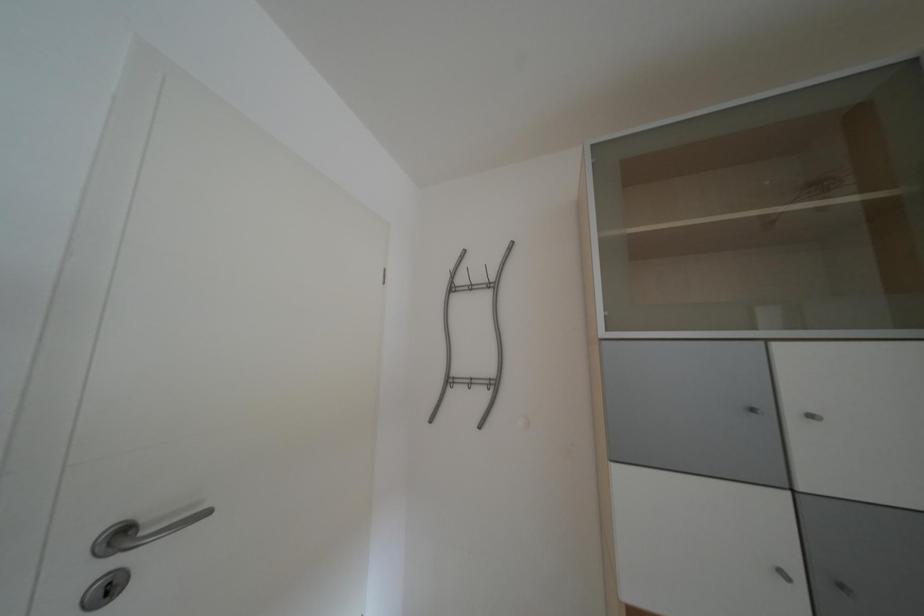
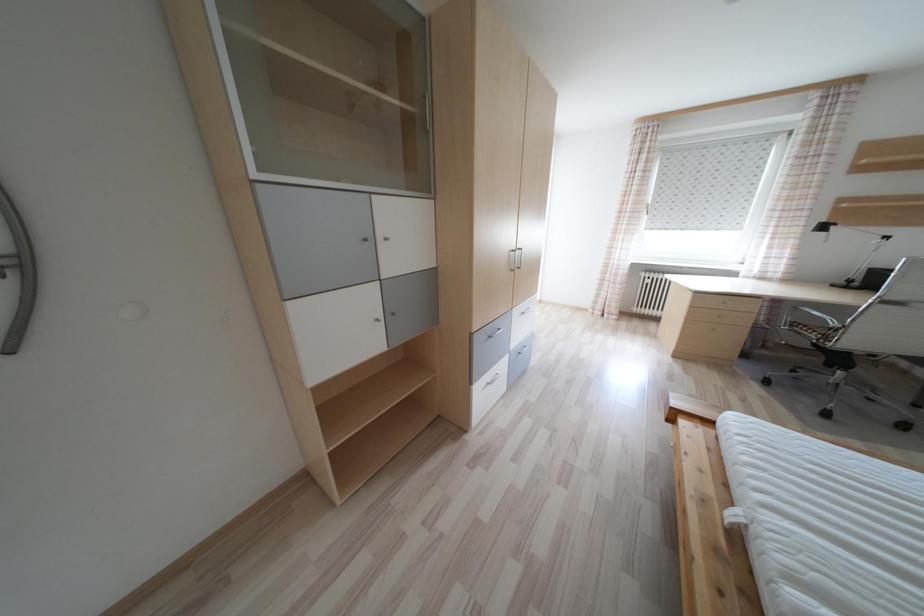
How did the camera likely rotate?

The rotation direction of the camera is right-down.